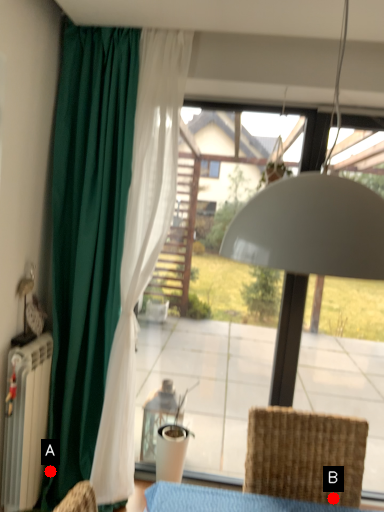
Question: Two points are circled on the image, labeled by A and B beside each circle. Which point is closer to the camera taking this photo?

Choices:
 (A) A is closer
 (B) B is closer

Answer: (B)